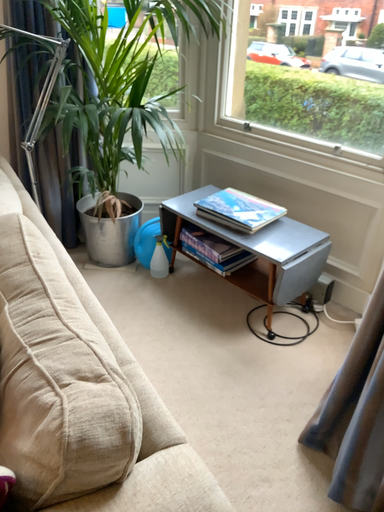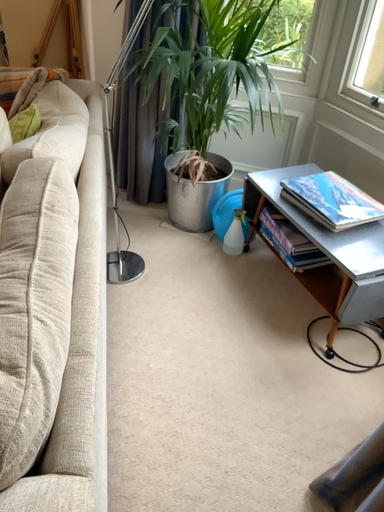
Question: How did the camera likely rotate when shooting the video?

Choices:
 (A) rotated right
 (B) rotated left

Answer: (B)